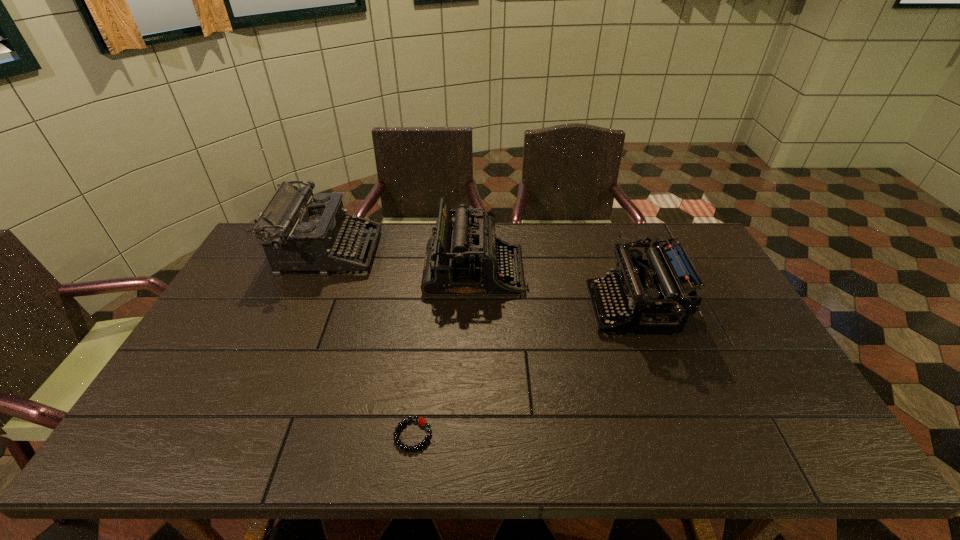
Where is `free space located 0.070m on the back of the nearest object`? free space located 0.070m on the back of the nearest object is located at coordinates (419, 392).

Find the location of a particular element. object located at the near edge is located at coordinates (421, 420).

Where is `object that is at the left edge`? object that is at the left edge is located at coordinates (304, 231).

Where is `object that is at the far left corner`? Image resolution: width=960 pixels, height=540 pixels. object that is at the far left corner is located at coordinates (304, 231).

Identify the location of vacant position at the far edge of the desktop. (547, 262).

This screenshot has width=960, height=540. I want to click on vacant space at the near edge of the desktop, so click(333, 428).

Locate an element on the screen. vacant space at the left edge of the desktop is located at coordinates (227, 292).

Where is `vacant area at the right edge of the desktop`? vacant area at the right edge of the desktop is located at coordinates (705, 334).

In the image, there is a desktop. At what (x,y) coordinates should I click in order to perform the action: click on vacant space at the near left corner. Please return your answer as a coordinate pair (x, y). Looking at the image, I should click on (181, 426).

Identify the location of vacant region between the rightmost object and the nearest object. Image resolution: width=960 pixels, height=540 pixels. click(522, 372).